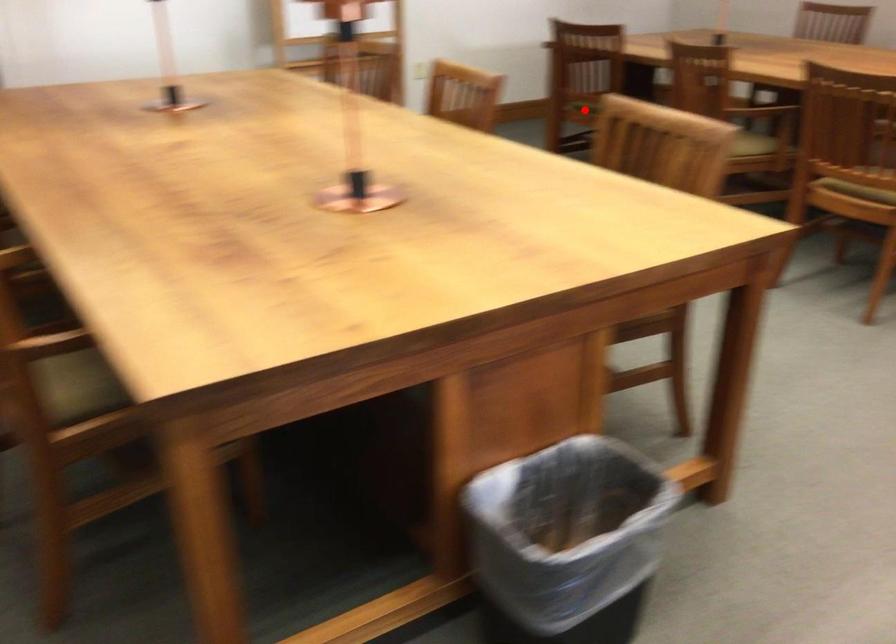
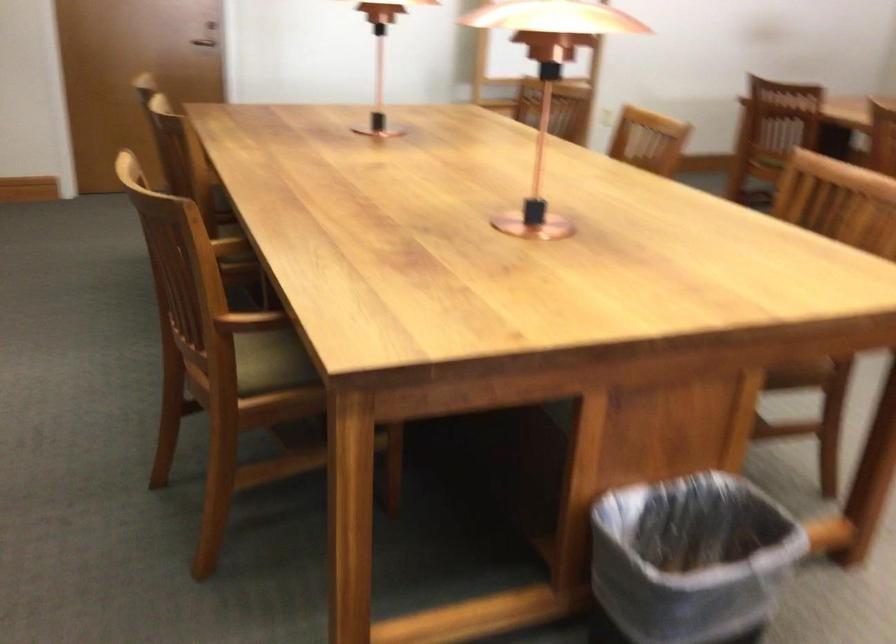
Where in the second image is the point corresponding to the highlighted location from the first image?

(767, 162)